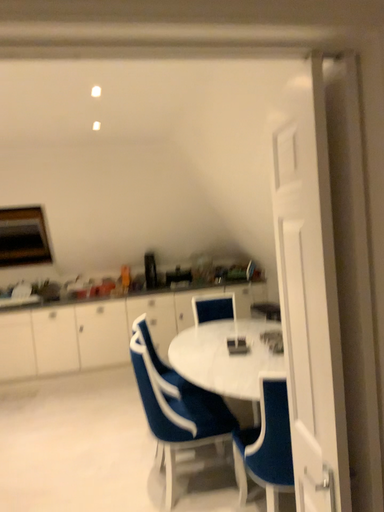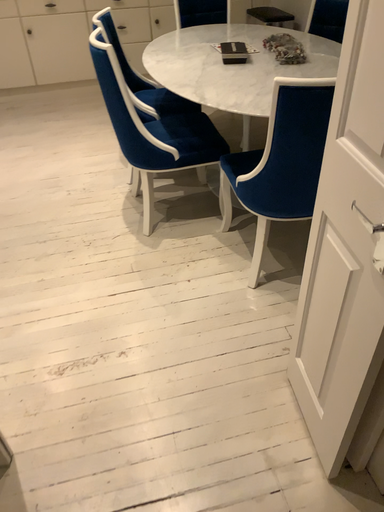
Question: How did the camera likely rotate when shooting the video?

Choices:
 (A) rotated downward
 (B) rotated upward

Answer: (A)